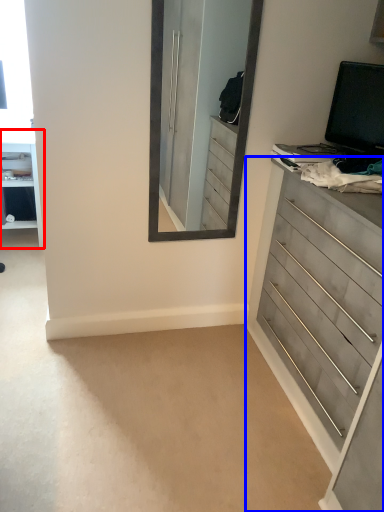
Question: Which object is closer to the camera taking this photo, vanity (highlighted by a red box) or chest of drawers (highlighted by a blue box)?

Choices:
 (A) vanity
 (B) chest of drawers

Answer: (B)